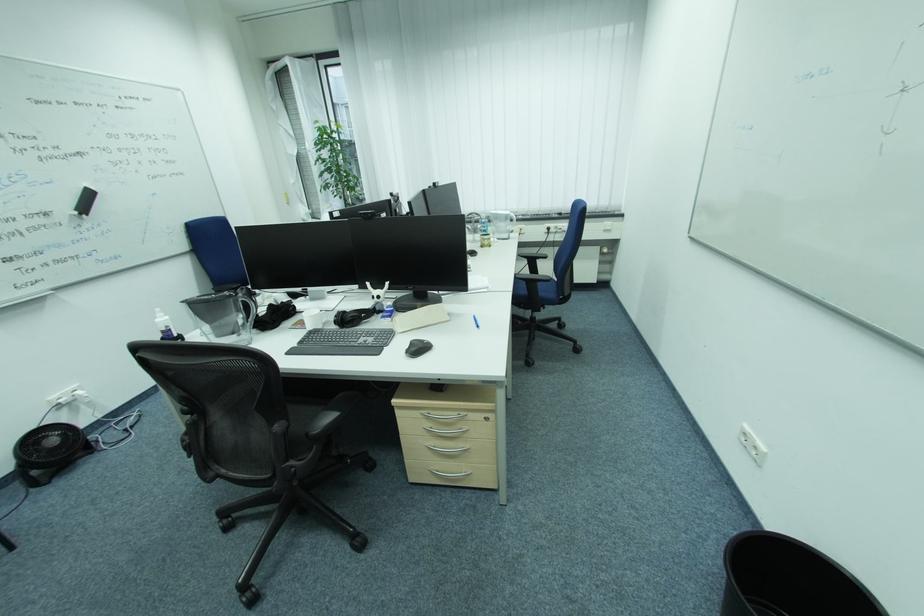
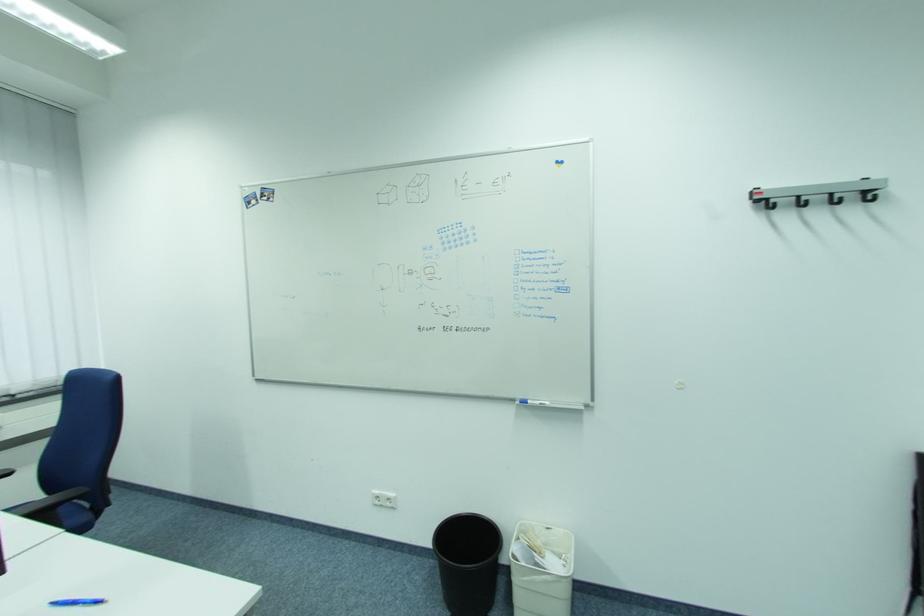
In the second image, find the point that corresponds to the point at 749,429 in the first image.

(380, 496)